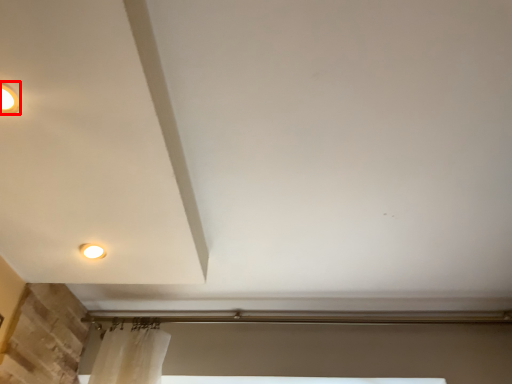
Question: From the image's perspective, where is lighting (annotated by the red box) located in relation to lamp in the image?

Choices:
 (A) below
 (B) above

Answer: (B)